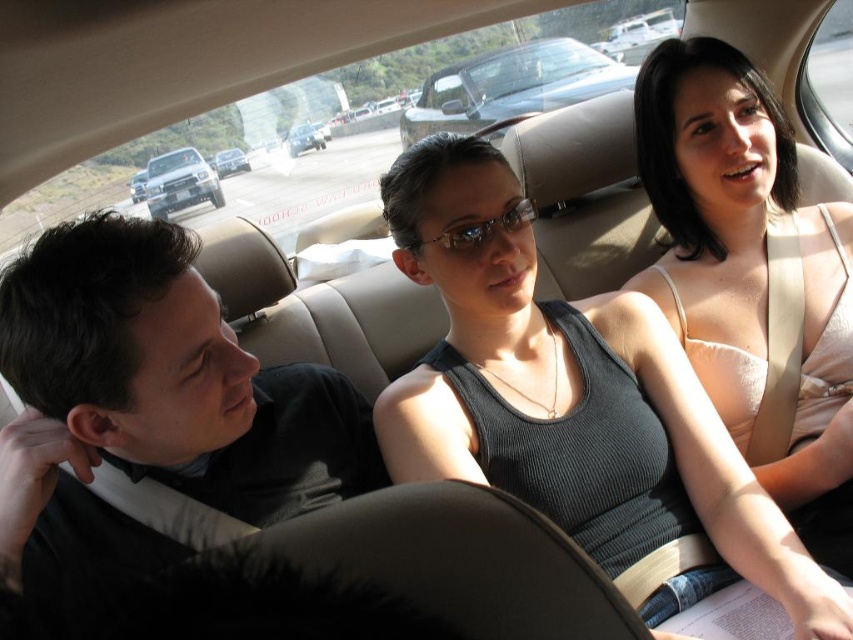
Question: Is ribbed gray tank top at center bigger than silver metallic truck at center?

Choices:
 (A) no
 (B) yes

Answer: (B)

Question: Among these objects, which one is nearest to the camera?

Choices:
 (A) silver metallic truck at upper left
 (B) light beige fabric tank top at center
 (C) black matte shirt at left

Answer: (C)

Question: Is the position of ribbed gray tank top at center more distant than that of silver metallic truck at upper left?

Choices:
 (A) no
 (B) yes

Answer: (A)

Question: Which object appears farthest from the camera in this image?

Choices:
 (A) matte black glasses at center
 (B) ribbed gray tank top at center

Answer: (A)

Question: Which point is closer to the camera taking this photo?

Choices:
 (A) click(230, 166)
 (B) click(756, 120)
 (C) click(434, 237)

Answer: (C)

Question: Observing the image, what is the correct spatial positioning of silver metallic convertible at center in reference to metallic silver sedan at center?

Choices:
 (A) above
 (B) below

Answer: (A)